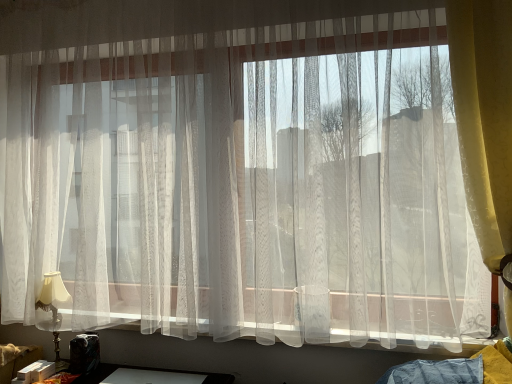
Question: Is matte gold table lamp at left at the left side of yellow textured curtain at right?

Choices:
 (A) yes
 (B) no

Answer: (A)

Question: Does matte gold table lamp at left appear on the right side of yellow textured curtain at right?

Choices:
 (A) yes
 (B) no

Answer: (B)

Question: Does matte gold table lamp at left have a greater height compared to yellow textured curtain at right?

Choices:
 (A) no
 (B) yes

Answer: (A)

Question: From a real-world perspective, is matte gold table lamp at left located beneath yellow textured curtain at right?

Choices:
 (A) yes
 (B) no

Answer: (A)

Question: Does matte gold table lamp at left lie behind yellow textured curtain at right?

Choices:
 (A) no
 (B) yes

Answer: (B)

Question: Considering the relative sizes of matte gold table lamp at left and yellow textured curtain at right in the image provided, is matte gold table lamp at left shorter than yellow textured curtain at right?

Choices:
 (A) yes
 (B) no

Answer: (A)

Question: From a real-world perspective, is yellow textured curtain at right on matte gold table lamp at left?

Choices:
 (A) no
 (B) yes

Answer: (B)

Question: Does yellow textured curtain at right appear on the left side of matte gold table lamp at left?

Choices:
 (A) no
 (B) yes

Answer: (A)

Question: Could you tell me if yellow textured curtain at right is turned towards matte gold table lamp at left?

Choices:
 (A) no
 (B) yes

Answer: (A)

Question: Does yellow textured curtain at right come in front of matte gold table lamp at left?

Choices:
 (A) yes
 (B) no

Answer: (A)

Question: Considering the relative positions of yellow textured curtain at right and matte gold table lamp at left in the image provided, is yellow textured curtain at right behind matte gold table lamp at left?

Choices:
 (A) no
 (B) yes

Answer: (A)

Question: From the image's perspective, is yellow textured curtain at right above matte gold table lamp at left?

Choices:
 (A) yes
 (B) no

Answer: (A)

Question: Considering the relative positions of matte gold table lamp at left and yellow textured curtain at right in the image provided, is matte gold table lamp at left to the left or to the right of yellow textured curtain at right?

Choices:
 (A) left
 (B) right

Answer: (A)